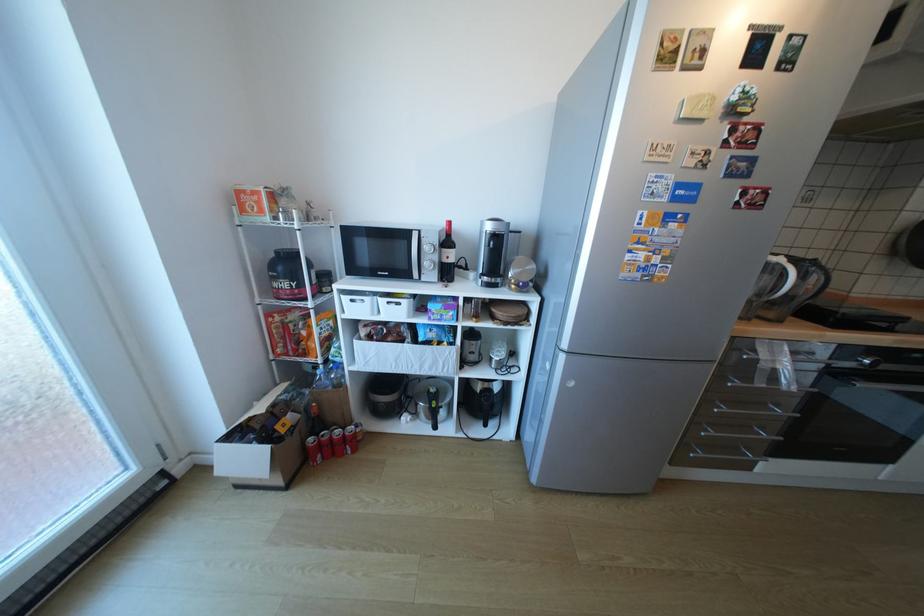
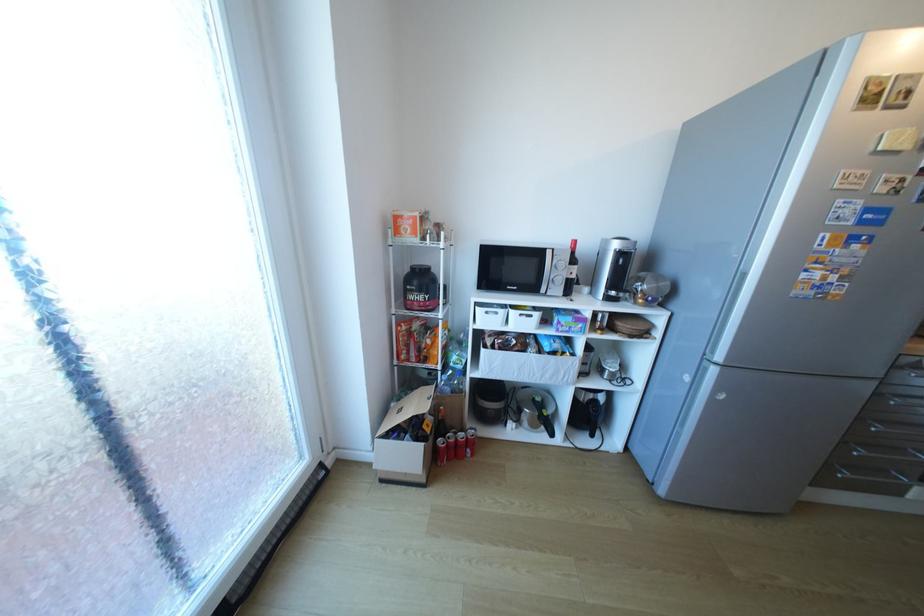
Find the pixel in the second image that matches [346,436] in the first image.

(469, 439)